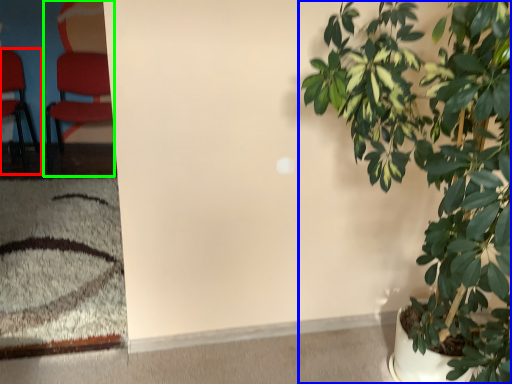
Question: Considering the real-world distances, which object is farthest from chair (highlighted by a red box)? houseplant (highlighted by a blue box) or chair (highlighted by a green box)?

Choices:
 (A) houseplant
 (B) chair

Answer: (A)